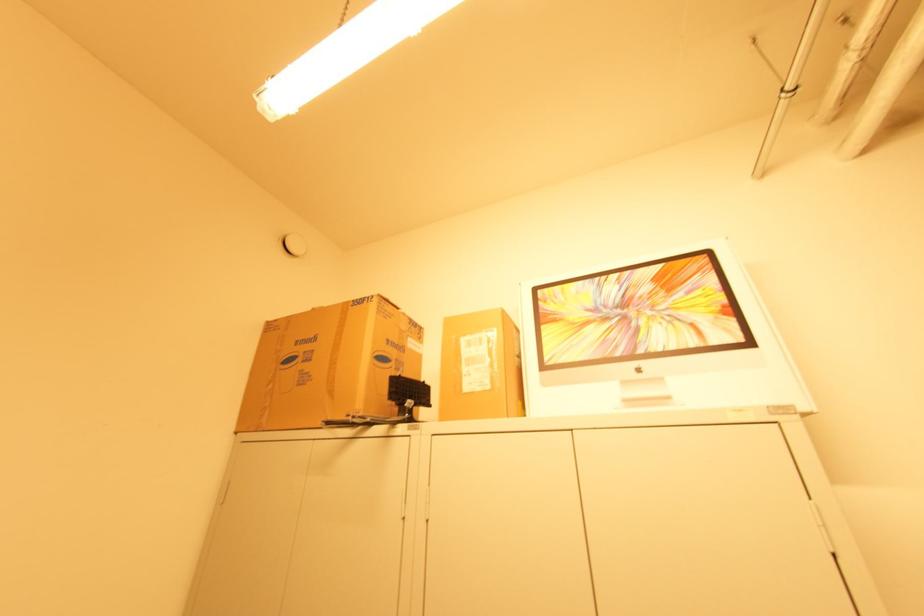
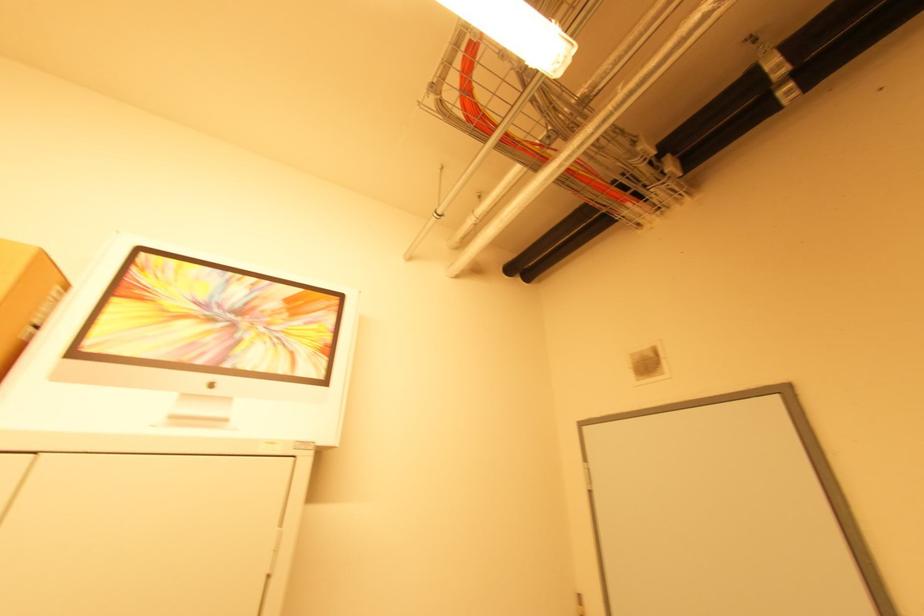
In the second image, find the point that corresponds to [520,359] in the first image.

(32, 329)